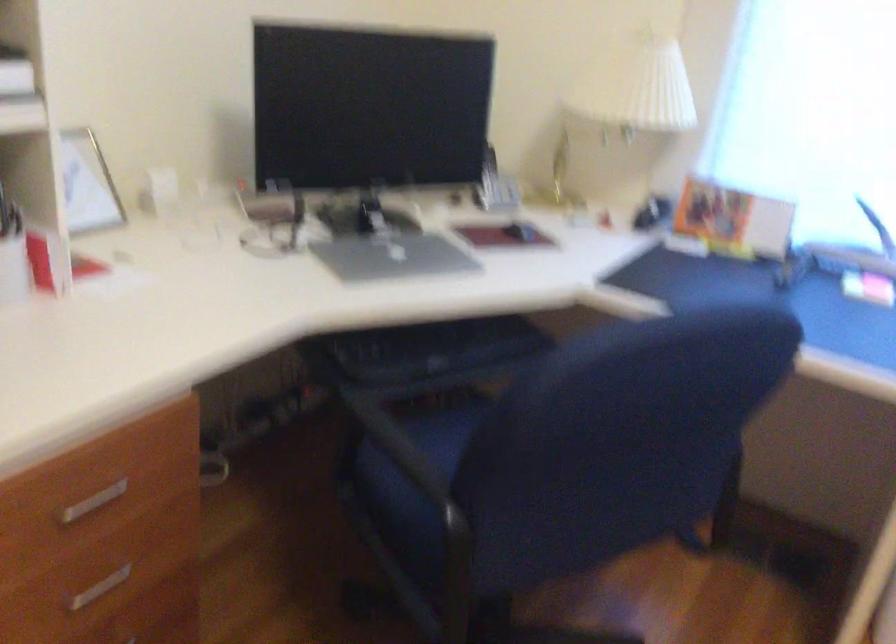
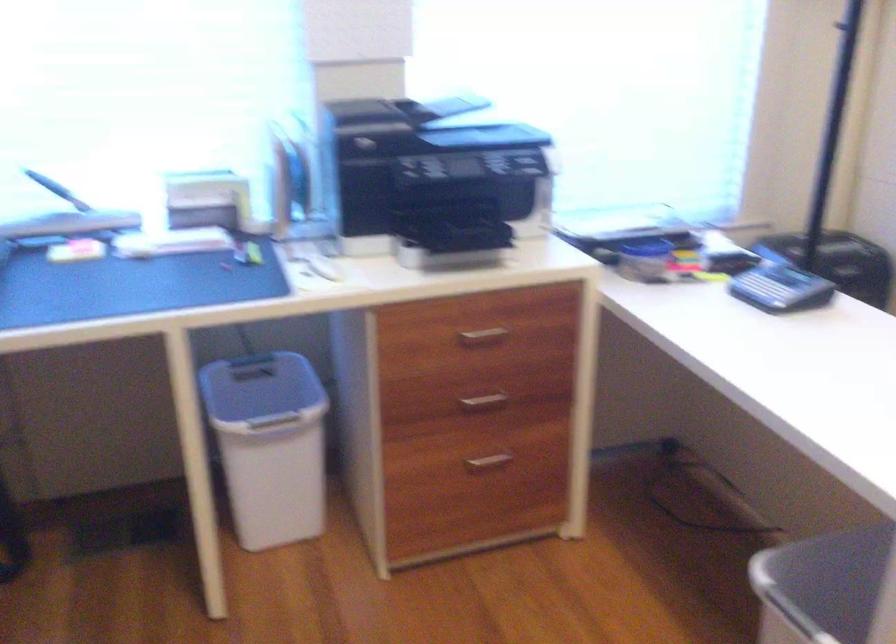
Question: The first image is from the beginning of the video and the second image is from the end. How did the camera likely rotate when shooting the video?

Choices:
 (A) Left
 (B) Right
 (C) Up
 (D) Down

Answer: (B)